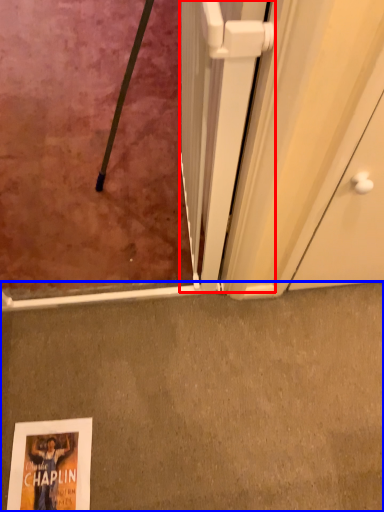
Question: Which of the following is the closest to the observer, screen door (highlighted by a red box) or concrete (highlighted by a blue box)?

Choices:
 (A) screen door
 (B) concrete

Answer: (A)